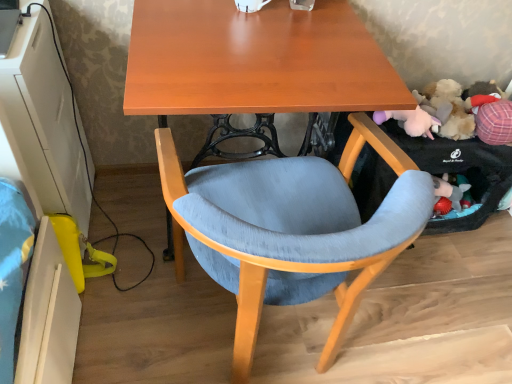
Question: From a real-world perspective, is fluffy plush toy at right positioned under textured fabric chair at center based on gravity?

Choices:
 (A) yes
 (B) no

Answer: (B)

Question: Is fluffy plush toy at right with textured fabric chair at center?

Choices:
 (A) no
 (B) yes

Answer: (A)

Question: Is fluffy plush toy at right taller than textured fabric chair at center?

Choices:
 (A) yes
 (B) no

Answer: (B)

Question: Is fluffy plush toy at right oriented away from textured fabric chair at center?

Choices:
 (A) no
 (B) yes

Answer: (A)

Question: Considering the relative sizes of fluffy plush toy at right and textured fabric chair at center in the image provided, is fluffy plush toy at right smaller than textured fabric chair at center?

Choices:
 (A) no
 (B) yes

Answer: (B)

Question: Considering the relative positions of textured fabric chair at center and matte wood desk at center in the image provided, is textured fabric chair at center to the left or to the right of matte wood desk at center?

Choices:
 (A) right
 (B) left

Answer: (A)

Question: In terms of size, does textured fabric chair at center appear bigger or smaller than matte wood desk at center?

Choices:
 (A) big
 (B) small

Answer: (B)

Question: Is textured fabric chair at center inside the boundaries of matte wood desk at center, or outside?

Choices:
 (A) inside
 (B) outside

Answer: (A)

Question: Considering the positions of textured fabric chair at center and matte wood desk at center in the image, is textured fabric chair at center taller or shorter than matte wood desk at center?

Choices:
 (A) tall
 (B) short

Answer: (B)

Question: Choose the correct answer: Is textured fabric chair at center inside fluffy plush toy at right or outside it?

Choices:
 (A) inside
 (B) outside

Answer: (B)

Question: Relative to fluffy plush toy at right, is textured fabric chair at center in front or behind?

Choices:
 (A) front
 (B) behind

Answer: (A)

Question: Considering the positions of textured fabric chair at center and fluffy plush toy at right in the image, is textured fabric chair at center taller or shorter than fluffy plush toy at right?

Choices:
 (A) short
 (B) tall

Answer: (B)

Question: In terms of size, does textured fabric chair at center appear bigger or smaller than fluffy plush toy at right?

Choices:
 (A) big
 (B) small

Answer: (A)

Question: In the image, is fluffy plush toy at right on the left side or the right side of matte wood desk at center?

Choices:
 (A) left
 (B) right

Answer: (B)

Question: Looking at the image, does fluffy plush toy at right seem bigger or smaller compared to matte wood desk at center?

Choices:
 (A) small
 (B) big

Answer: (A)